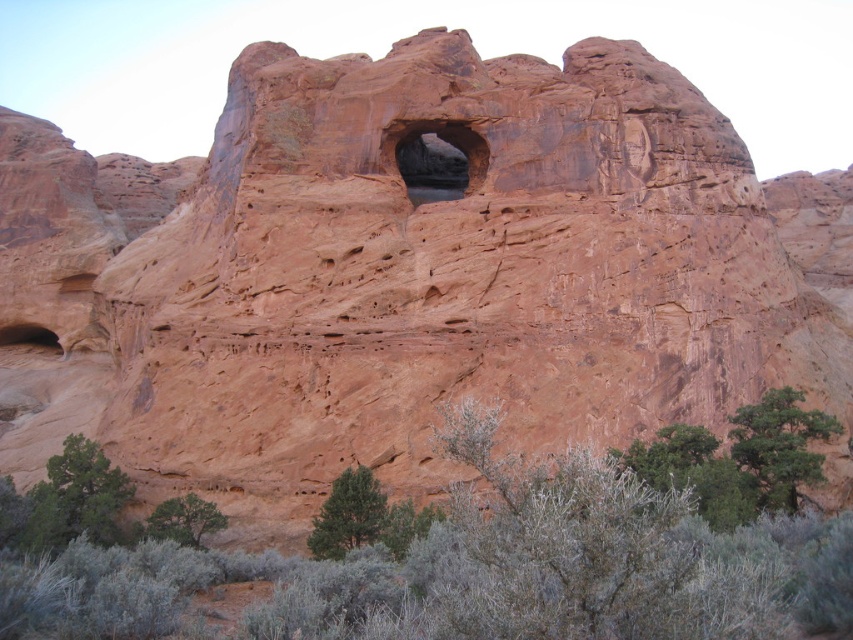
You are an explorer standing at the base of the rock formation. You notice the green leafy tree at lower right and the smooth sandstone arch at center. Which object would appear closer to you when looking from your current position?

The green leafy tree at lower right appears closer because it is positioned in the lower right foreground, whereas the smooth sandstone arch at center is part of the central rock formation, placing it farther away.

Based on the photo, you are standing at the center of the rock formation and see the point at coordinates (779, 445). What object is located at that point?

The green leafy tree at lower right is located at point (779, 445).